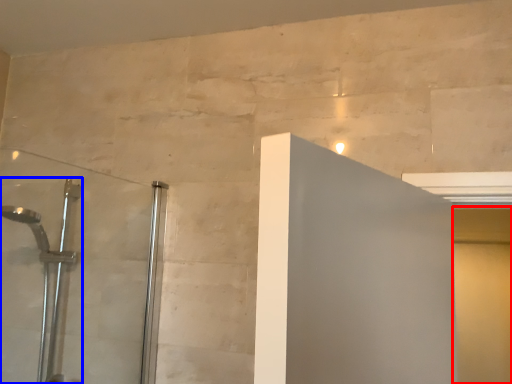
Question: Which object is further to the camera taking this photo, screen door (highlighted by a red box) or shower (highlighted by a blue box)?

Choices:
 (A) screen door
 (B) shower

Answer: (A)